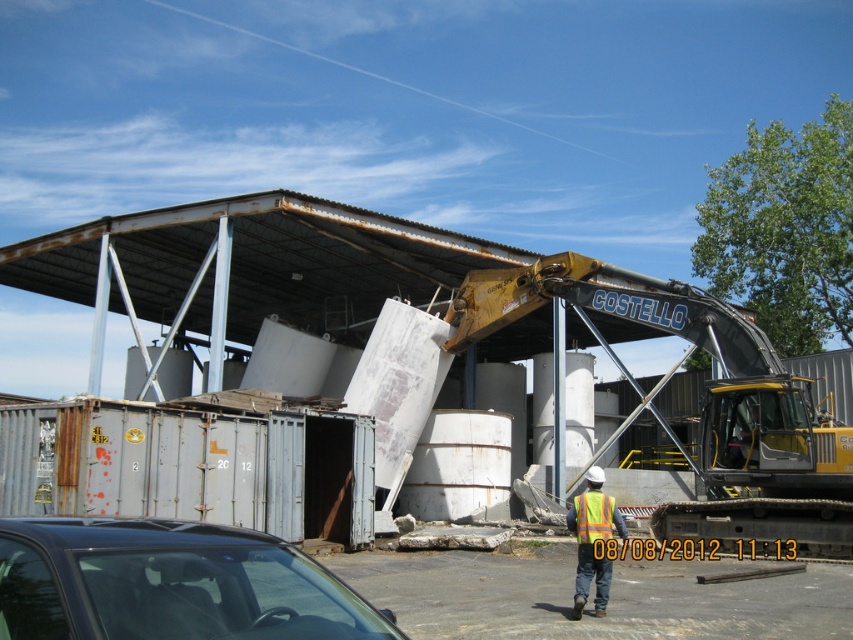
Question: Can you confirm if yellow metallic excavator at center is thinner than black glossy car at lower left?

Choices:
 (A) yes
 (B) no

Answer: (B)

Question: Which point is farther to the camera?

Choices:
 (A) (787, 452)
 (B) (51, 525)
 (C) (576, 504)

Answer: (A)

Question: Which point is farther to the camera?

Choices:
 (A) reflective yellow safety vest at center
 (B) black glossy car at lower left
 (C) yellow metallic excavator at center
 (D) yellow reflective vest at center

Answer: (C)

Question: Observing the image, what is the correct spatial positioning of black glossy car at lower left in reference to yellow reflective vest at center?

Choices:
 (A) right
 (B) left

Answer: (B)

Question: Which point appears farthest from the camera in this image?

Choices:
 (A) (223, 568)
 (B) (602, 528)
 (C) (576, 576)
 (D) (672, 524)

Answer: (D)

Question: Considering the relative positions of black glossy car at lower left and yellow reflective vest at center in the image provided, where is black glossy car at lower left located with respect to yellow reflective vest at center?

Choices:
 (A) above
 (B) below

Answer: (A)